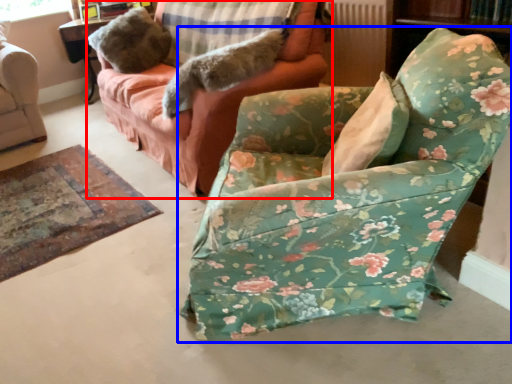
Question: Which point is closer to the camera, studio couch (highlighted by a red box) or chair (highlighted by a blue box)?

Choices:
 (A) studio couch
 (B) chair

Answer: (B)